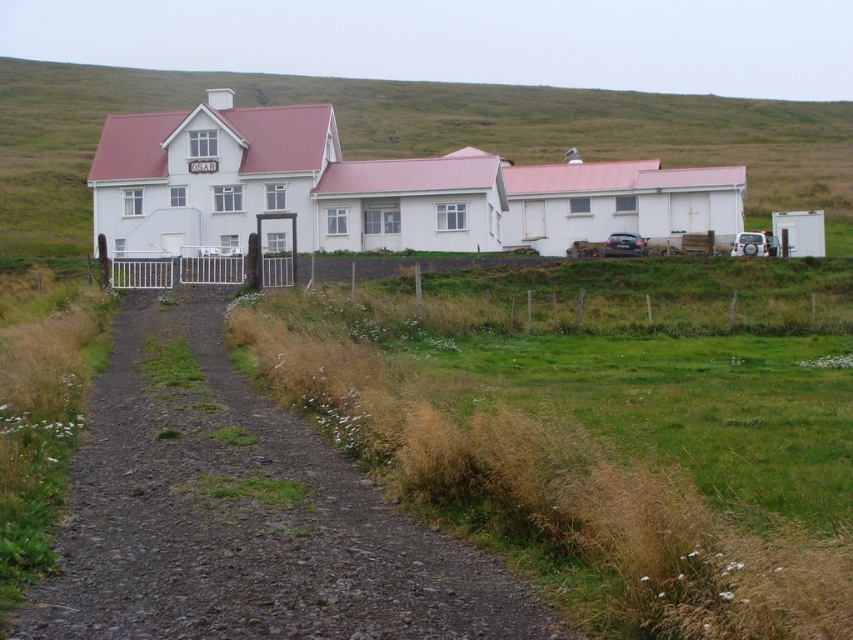
Does green grassy at lower left come behind silver metallic suv at right?

No, it is in front of silver metallic suv at right.

Can you confirm if green grassy at lower left is bigger than silver metallic suv at right?

Correct, green grassy at lower left is larger in size than silver metallic suv at right.

Describe the element at coordinates (601, 428) in the screenshot. This screenshot has width=853, height=640. I see `green grassy at lower left` at that location.

You are a GUI agent. You are given a task and a screenshot of the screen. Output one action in this format:
    pyautogui.click(x=<x>, y=<y>)
    Task: Click on the green grassy at lower left
    
    Given the screenshot: What is the action you would take?
    pyautogui.click(x=601, y=428)

Between green grassy hillside at upper center and silver metallic suv at right, which one appears on the left side from the viewer's perspective?

Positioned to the left is green grassy hillside at upper center.

Which is behind, point (421, 122) or point (763, 253)?

The point (421, 122) is more distant.

Locate an element on the screen. This screenshot has height=640, width=853. green grassy hillside at upper center is located at coordinates (416, 134).

Which is behind, point (409, 541) or point (624, 253)?

The point (624, 253) is behind.

Is dirt/gravel path at center thinner than metallic silver car at right?

Incorrect, dirt/gravel path at center's width is not less than metallic silver car at right's.

Does point (306, 477) come farther from viewer compared to point (618, 252)?

No, (306, 477) is closer to viewer.

Identify the location of dirt/gravel path at center. (242, 515).